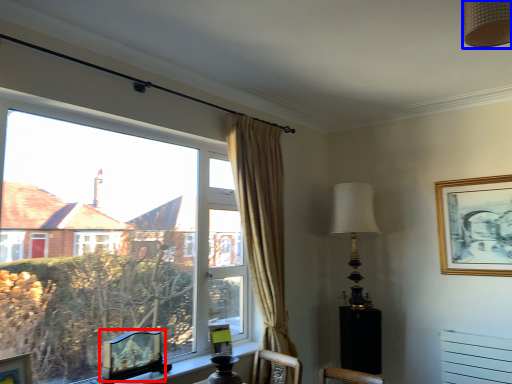
Question: Which object is closer to the camera taking this photo, picture frame (highlighted by a red box) or lamp (highlighted by a blue box)?

Choices:
 (A) picture frame
 (B) lamp

Answer: (B)